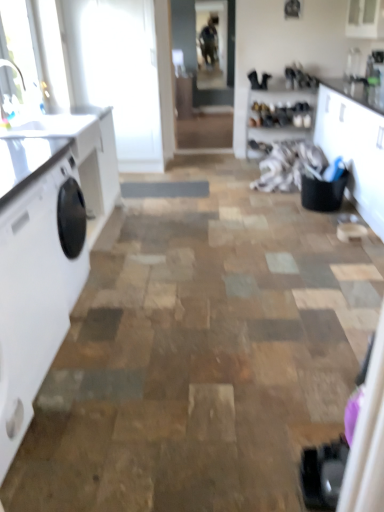
Question: Would you say white glossy countertop at left is to the left or to the right of white glossy cabinet at right in the picture?

Choices:
 (A) right
 (B) left

Answer: (B)

Question: Is white glossy countertop at left in front of or behind white glossy cabinet at right in the image?

Choices:
 (A) behind
 (B) front

Answer: (B)

Question: Based on their relative distances, which object is nearer to the white fabric at center?

Choices:
 (A) white glossy countertop at left
 (B) white glossy cabinet at right
 (C) white glossy countertop at left
 (D) white glossy washing machine at left
 (E) clear glass window screen at upper center

Answer: (B)

Question: Which is farther from the white glossy countertop at left?

Choices:
 (A) white glossy cabinet at right
 (B) white glossy washing machine at left
 (C) white fabric at center
 (D) white glossy countertop at left
 (E) clear glass window screen at upper center

Answer: (E)